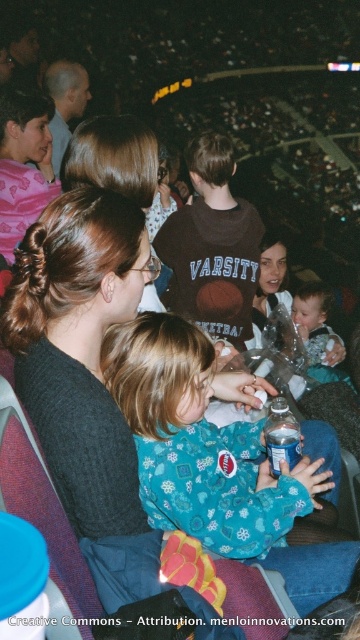
Can you confirm if teal fleece pajamas at center is positioned to the left of brown cotton shirt at center?

No, teal fleece pajamas at center is not to the left of brown cotton shirt at center.

Who is positioned more to the right, teal fleece pajamas at center or brown cotton shirt at center?

From the viewer's perspective, teal fleece pajamas at center appears more on the right side.

Image resolution: width=360 pixels, height=640 pixels. Find the location of `teal fleece pajamas at center`. teal fleece pajamas at center is located at coordinates (217, 458).

Is teal fleece pajamas at center to the right of smooth plastic baby at center from the viewer's perspective?

No, teal fleece pajamas at center is not to the right of smooth plastic baby at center.

Who is positioned more to the left, teal fleece pajamas at center or smooth plastic baby at center?

Positioned to the left is teal fleece pajamas at center.

In the scene shown: Who is more forward, (167,483) or (320,333)?

Positioned in front is point (167,483).

Locate an element on the screen. The image size is (360, 640). teal fleece pajamas at center is located at coordinates (217, 458).

Is teal fleece pajamas at center further to the viewer compared to matte black shirt at upper left?

That is False.

Does point (344, 563) come behind point (75, 116)?

No, it is in front of (75, 116).

Locate an element on the screen. teal fleece pajamas at center is located at coordinates (217, 458).

Identify the location of teal fleece pajamas at center. (217, 458).